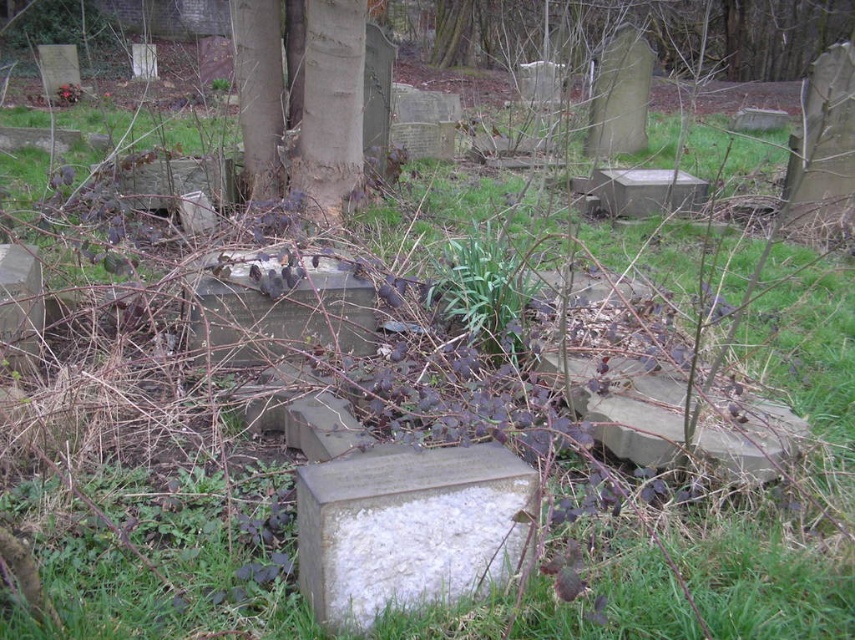
You are standing in the overgrown cemetery and want to touch the white stone gravestone at center and the brown rough bark at center. Which object can you reach first without moving your position?

The white stone gravestone at center is closer to the viewer than the brown rough bark at center, so you can reach the white stone gravestone at center first without moving your position.

You are standing in the overgrown cemetery described. You see a white stone gravestone at center and a brown rough bark at center. Which object is positioned to the right of the other?

The white stone gravestone at center is to the right of the brown rough bark at center.

You are standing in a cemetery and want to place a bouquet of flowers at the base of the white stone gravestone at center. If you are currently 10 feet away from it, how many more feet do you need to walk forward to reach it?

The white stone gravestone at center is 4.87 feet away from the viewer. Since you are currently 10 feet away, you need to walk forward 10 minus 4.87 equals 5.13 feet more to reach it.